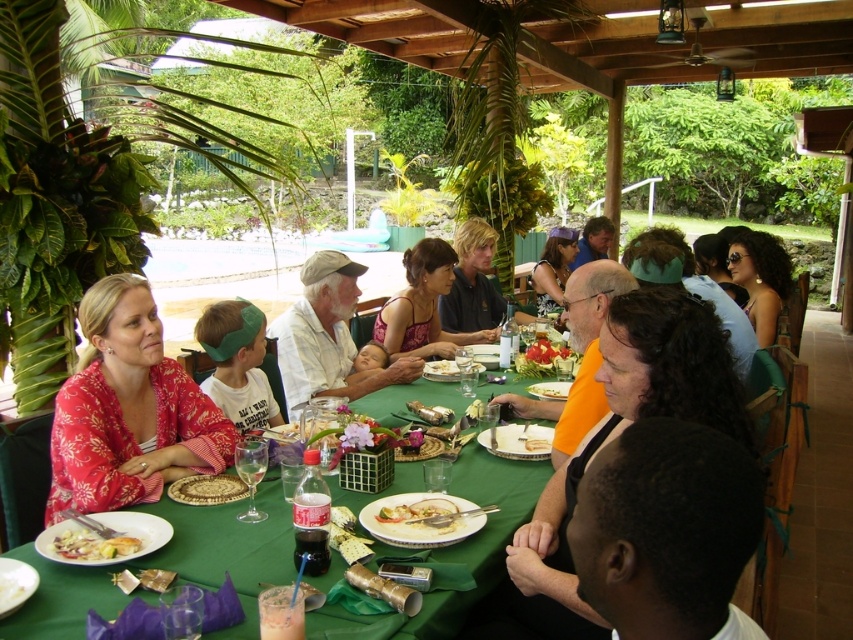
Based on the photo, you are a photographer taking a picture of the scene. You notice the white cotton shirt at center and the blue fabric shirt at upper center. Which shirt should you focus on to ensure it appears larger in the photo?

Result: The white cotton shirt at center has a greater height compared to the blue fabric shirt at upper center, so focusing on it will make it appear larger in the photo.

You are a guest at this outdoor event and want to pass a plate from the point at coordinate (561, 237) to another guest sitting 6.05 meters away. Is this distance within a comfortable reaching distance for passing items?

The distance between the point at coordinate (561, 237) and the guest is 6.05 meters, which is quite far for comfortable reaching. It would be better to use a tray or ask someone to help pass the plate.